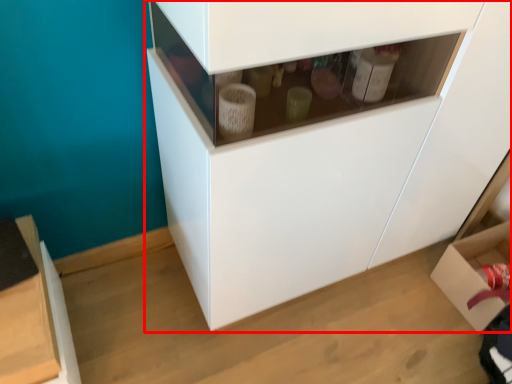
Question: In this image, where is cabinetry (annotated by the red box) located relative to cardboard box?

Choices:
 (A) left
 (B) right

Answer: (A)